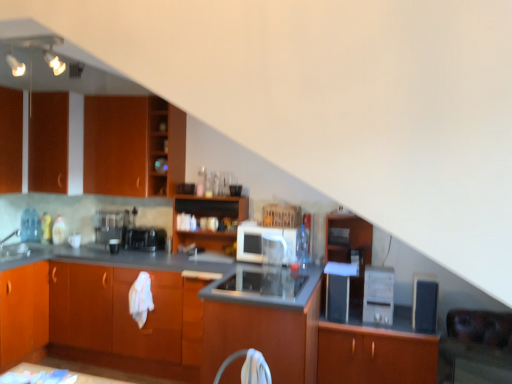
I want to click on free point above black plastic coffee maker at center, which appears as the 1th appliance when viewed from the left (from a real-world perspective), so click(x=142, y=228).